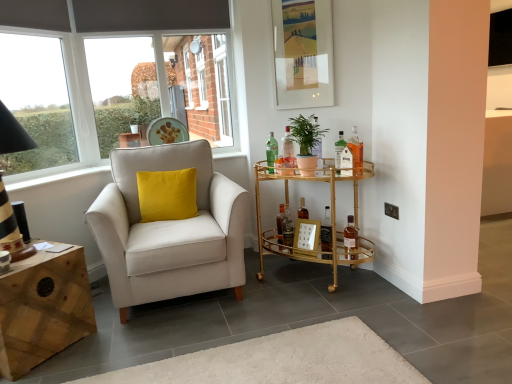
Identify the location of transparent glass window at upper left. The width and height of the screenshot is (512, 384). (37, 101).

The width and height of the screenshot is (512, 384). In order to click on brown glass bottle at center, the 8th bottle from the left in this screenshot , I will do click(350, 235).

Image resolution: width=512 pixels, height=384 pixels. Describe the element at coordinates (350, 235) in the screenshot. I see `brown glass bottle at center, the 1th bottle when ordered from right to left` at that location.

What do you see at coordinates (303, 53) in the screenshot? Image resolution: width=512 pixels, height=384 pixels. I see `matte glass picture frame at upper center` at bounding box center [303, 53].

How much space does translucent glass bottle at upper right, which appears as the 7th bottle when viewed from the left, occupy horizontally?

It is 6.07 centimeters.

Find the location of `satin yellow pillow at center`. satin yellow pillow at center is located at coordinates (167, 195).

Describe the element at coordinates (167, 195) in the screenshot. I see `satin yellow pillow at center` at that location.

What is the approximate width of translucent glass bottle at center, which is counted as the seventh bottle, starting from the right?

3.35 inches.

Image resolution: width=512 pixels, height=384 pixels. What do you see at coordinates (42, 309) in the screenshot?
I see `natural wood desk at lower left` at bounding box center [42, 309].

Locate an element on the screen. The width and height of the screenshot is (512, 384). black plastic power outlet at upper right is located at coordinates (391, 210).

From a real-world perspective, is white glass bottle at center, positioned as the 6th bottle in left-to-right order, below satin yellow pillow at center?

No, from a real-world perspective, white glass bottle at center, positioned as the 6th bottle in left-to-right order, is not under satin yellow pillow at center.

Considering the relative positions of white glass bottle at center, the 3th bottle viewed from the right, and satin yellow pillow at center in the image provided, is white glass bottle at center, the 3th bottle viewed from the right, in front of satin yellow pillow at center?

Yes, it is.

Would you say white glass bottle at center, the 3th bottle viewed from the right, contains satin yellow pillow at center?

That's incorrect, satin yellow pillow at center is not inside white glass bottle at center, the 3th bottle viewed from the right.

From a real-world perspective, which bottle is the 1st one above the satin yellow pillow at center? Please provide its 2D coordinates.

[(339, 151)]

In terms of size, does translucent glass bottle at upper right, which appears as the 7th bottle when viewed from the left, appear bigger or smaller than black plastic power outlet at upper right?

Clearly, translucent glass bottle at upper right, which appears as the 7th bottle when viewed from the left, is larger in size than black plastic power outlet at upper right.

You are a GUI agent. You are given a task and a screenshot of the screen. Output one action in this format:
    pyautogui.click(x=<x>, y=<y>)
    Task: Click on the bottle that is the 3rd one when counting upward from the black plastic power outlet at upper right (from the image's perspective)
    This screenshot has width=512, height=384.
    Given the screenshot: What is the action you would take?
    pyautogui.click(x=356, y=148)

Does translucent glass bottle at upper right, which ranks as the second bottle in right-to-left order, turn towards black plastic power outlet at upper right?

No.

Is black plastic power outlet at upper right surrounded by translucent glass bottle at upper right, which ranks as the second bottle in right-to-left order?

No.

Looking at this image, from a real-world perspective, is black plastic power outlet at upper right physically located above or below green glass bottle at center, arranged as the 8th bottle when viewed from the right?

black plastic power outlet at upper right is situated lower than green glass bottle at center, arranged as the 8th bottle when viewed from the right, in the real world.

From the image's perspective, is black plastic power outlet at upper right located above green glass bottle at center, arranged as the 8th bottle when viewed from the right?

No, from the image's perspective, black plastic power outlet at upper right is not above green glass bottle at center, arranged as the 8th bottle when viewed from the right.

Which object is thinner, black plastic power outlet at upper right or green glass bottle at center, the 1th bottle from the left?

Thinner between the two is black plastic power outlet at upper right.

Considering the relative sizes of black plastic power outlet at upper right and green glass bottle at center, arranged as the 8th bottle when viewed from the right, in the image provided, is black plastic power outlet at upper right shorter than green glass bottle at center, arranged as the 8th bottle when viewed from the right,?

Indeed, black plastic power outlet at upper right has a lesser height compared to green glass bottle at center, arranged as the 8th bottle when viewed from the right.

From the image's perspective, relative to natural wood desk at lower left, is translucent glass bottle at center, marked as the second bottle in a left-to-right arrangement, above or below?

translucent glass bottle at center, marked as the second bottle in a left-to-right arrangement, is situated higher than natural wood desk at lower left in the image.

From a real-world perspective, who is located lower, translucent glass bottle at center, marked as the second bottle in a left-to-right arrangement, or natural wood desk at lower left?

natural wood desk at lower left.

Is translucent glass bottle at center, marked as the second bottle in a left-to-right arrangement, looking in the opposite direction of natural wood desk at lower left?

That's not correct — translucent glass bottle at center, marked as the second bottle in a left-to-right arrangement, is not looking away from natural wood desk at lower left.

Is matte glass picture frame at upper center aimed at translucent glass bottle at upper right, which ranks as the second bottle in right-to-left order?

No, matte glass picture frame at upper center is not oriented towards translucent glass bottle at upper right, which ranks as the second bottle in right-to-left order.

Image resolution: width=512 pixels, height=384 pixels. There is a matte glass picture frame at upper center. In order to click on the 1st bottle below it (from a real-world perspective) in this screenshot , I will do `click(356, 148)`.

From the image's perspective, is matte glass picture frame at upper center located above or below translucent glass bottle at upper right, which ranks as the second bottle in right-to-left order?

Clearly, from the image's perspective, matte glass picture frame at upper center is above translucent glass bottle at upper right, which ranks as the second bottle in right-to-left order.

From a real-world perspective, which object rests below the other?

translucent glass bottle at upper right, which appears as the 7th bottle when viewed from the left.

Which is more to the left, brown glass bottle at center, the 1th bottle when ordered from right to left, or matte white armchair at left?

matte white armchair at left.

From the picture: Is brown glass bottle at center, the 8th bottle from the left, positioned beyond the bounds of matte white armchair at left?

Yes, brown glass bottle at center, the 8th bottle from the left, is outside of matte white armchair at left.

Considering the relative sizes of brown glass bottle at center, the 8th bottle from the left, and matte white armchair at left in the image provided, is brown glass bottle at center, the 8th bottle from the left, bigger than matte white armchair at left?

No.

From the picture: Which of these two, brown glass bottle at center, the 8th bottle from the left, or matte white armchair at left, stands shorter?

Standing shorter between the two is brown glass bottle at center, the 8th bottle from the left.

What's the angular difference between natural wood desk at lower left and satin yellow pillow at center's facing directions?

67.4 degrees separate the facing orientations of natural wood desk at lower left and satin yellow pillow at center.

Which is behind, natural wood desk at lower left or satin yellow pillow at center?

satin yellow pillow at center is further from the camera.

How much distance is there between natural wood desk at lower left and satin yellow pillow at center?

The distance of natural wood desk at lower left from satin yellow pillow at center is 32.94 inches.

Considering the relative sizes of natural wood desk at lower left and satin yellow pillow at center in the image provided, is natural wood desk at lower left thinner than satin yellow pillow at center?

Incorrect, the width of natural wood desk at lower left is not less than that of satin yellow pillow at center.

You are a GUI agent. You are given a task and a screenshot of the screen. Output one action in this format:
    pyautogui.click(x=<x>, y=<y>)
    Task: Click on the pillow behind the white glass bottle at center, positioned as the 6th bottle in left-to-right order
    
    Given the screenshot: What is the action you would take?
    click(167, 195)

From the image's perspective, count 3rd bottles upward from the black plastic power outlet at upper right and point to it. Please provide its 2D coordinates.

[(356, 148)]

When comparing their distances from translucent glass bottle at center, marked as the second bottle in a left-to-right arrangement, does white glass bottle at center, the 3th bottle viewed from the right, or matte glass picture frame at upper center seem further?

Among the two, matte glass picture frame at upper center is located further to translucent glass bottle at center, marked as the second bottle in a left-to-right arrangement.

Considering their positions, is natural wood desk at lower left positioned closer to green matte plant at center than black plastic power outlet at upper right?

black plastic power outlet at upper right.

Considering their positions, is white glass bottle at center, the 3th bottle viewed from the right, positioned further to translucent glass bottle at center, placed as the fifth bottle when sorted from left to right, than translucent glass bottle at center, which is counted as the seventh bottle, starting from the right?

Among the two, white glass bottle at center, the 3th bottle viewed from the right, is located further to translucent glass bottle at center, placed as the fifth bottle when sorted from left to right.

From the image, which object appears to be farther from clear glass bottle at center, which is the fifth bottle in right-to-left order, translucent glass bottle at center, marked as the second bottle in a left-to-right arrangement, or white glass bottle at center, positioned as the 6th bottle in left-to-right order?

translucent glass bottle at center, marked as the second bottle in a left-to-right arrangement, lies further to clear glass bottle at center, which is the fifth bottle in right-to-left order, than the other object.

Which object lies further to the anchor point brown glass bottle at center, the 1th bottle when ordered from right to left, matte white armchair at left or satin yellow pillow at center?

satin yellow pillow at center.

Which object lies further to the anchor point natural wood desk at lower left, green matte plant at center or white glass bottle at center, positioned as the 6th bottle in left-to-right order?

Among the two, white glass bottle at center, positioned as the 6th bottle in left-to-right order, is located further to natural wood desk at lower left.

Based on their spatial positions, is matte glass picture frame at upper center or translucent glass bottle at center, which is counted as the seventh bottle, starting from the right, closer to translucent glass bottle at upper right, which ranks as the second bottle in right-to-left order?

Among the two, matte glass picture frame at upper center is located nearer to translucent glass bottle at upper right, which ranks as the second bottle in right-to-left order.

Considering their positions, is translucent glass bottle at center, which ranks as the 6th bottle in right-to-left order, positioned closer to green glass bottle at center, arranged as the 8th bottle when viewed from the right, than black plastic power outlet at upper right?

translucent glass bottle at center, which ranks as the 6th bottle in right-to-left order, lies closer to green glass bottle at center, arranged as the 8th bottle when viewed from the right, than the other object.

Identify the location of pillow between natural wood desk at lower left and translucent glass bottle at center, marked as the second bottle in a left-to-right arrangement, in the horizontal direction. (167, 195).

What are the coordinates of `houseplant between natural wood desk at lower left and translucent glass bottle at upper right, which ranks as the second bottle in right-to-left order, from left to right` in the screenshot? It's located at (306, 142).

You are a GUI agent. You are given a task and a screenshot of the screen. Output one action in this format:
    pyautogui.click(x=<x>, y=<y>)
    Task: Click on the chair between transparent glass window at upper left and matte glass picture frame at upper center in the horizontal direction
    Image resolution: width=512 pixels, height=384 pixels.
    Given the screenshot: What is the action you would take?
    pyautogui.click(x=169, y=230)

Image resolution: width=512 pixels, height=384 pixels. What are the coordinates of `power outlet between translucent glass bottle at upper right, which ranks as the second bottle in right-to-left order, and gold mirrored bar cart at center right from top to bottom` in the screenshot? It's located at (391, 210).